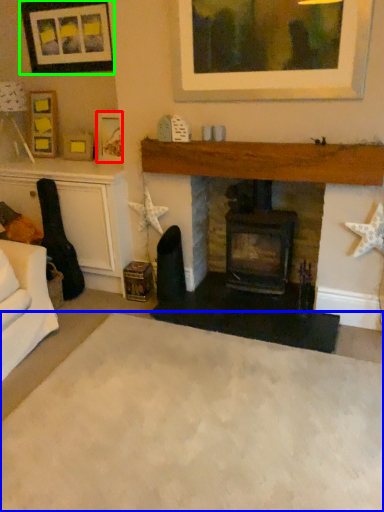
Question: Which object is the farthest from picture frame (highlighted by a red box)? Choose among these: plain (highlighted by a blue box) or picture frame (highlighted by a green box).

Choices:
 (A) plain
 (B) picture frame

Answer: (A)